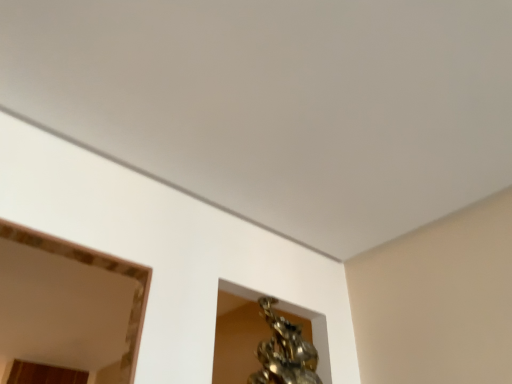
Question: From a real-world perspective, is matte gold mirror at upper left positioned above or below shiny bronze statue at upper center?

Choices:
 (A) above
 (B) below

Answer: (A)

Question: In the image, is matte gold mirror at upper left positioned in front of or behind shiny bronze statue at upper center?

Choices:
 (A) front
 (B) behind

Answer: (B)

Question: Is point (142, 289) positioned closer to the camera than point (258, 380)?

Choices:
 (A) farther
 (B) closer

Answer: (B)

Question: Is shiny bronze statue at upper center inside or outside of matte gold mirror at upper left?

Choices:
 (A) inside
 (B) outside

Answer: (B)

Question: Relative to matte gold mirror at upper left, is shiny bronze statue at upper center in front or behind?

Choices:
 (A) front
 (B) behind

Answer: (A)

Question: Considering the positions of shiny bronze statue at upper center and matte gold mirror at upper left in the image, is shiny bronze statue at upper center bigger or smaller than matte gold mirror at upper left?

Choices:
 (A) big
 (B) small

Answer: (B)

Question: Is shiny bronze statue at upper center wider or thinner than matte gold mirror at upper left?

Choices:
 (A) wide
 (B) thin

Answer: (B)